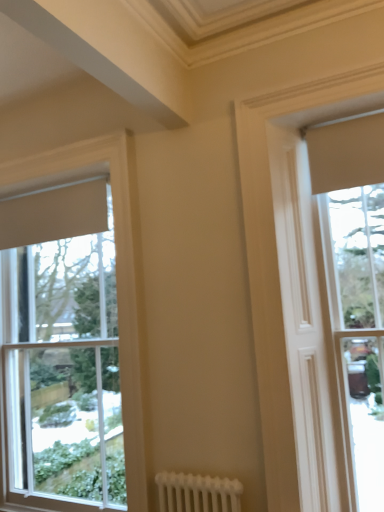
Question: Considering the relative positions of white wood window at left, which ranks as the 1th window in left-to-right order, and matte beige window at upper right, which is the 2th window from right to left, in the image provided, is white wood window at left, which ranks as the 1th window in left-to-right order, to the left of matte beige window at upper right, which is the 2th window from right to left, from the viewer's perspective?

Choices:
 (A) yes
 (B) no

Answer: (A)

Question: Is white wood window at left, which ranks as the 1th window in left-to-right order, bigger than matte beige window at upper right, the second window when ordered from left to right?

Choices:
 (A) no
 (B) yes

Answer: (B)

Question: Is white wood window at left, marked as the 3th window in a right-to-left arrangement, positioned with its back to matte beige window at upper right, the second window when ordered from left to right?

Choices:
 (A) no
 (B) yes

Answer: (A)

Question: From the image's perspective, is white wood window at left, which ranks as the 1th window in left-to-right order, beneath matte beige window at upper right, the second window when ordered from left to right?

Choices:
 (A) yes
 (B) no

Answer: (A)

Question: Is white wood window at left, which ranks as the 1th window in left-to-right order, outside of matte beige window at upper right, the second window when ordered from left to right?

Choices:
 (A) no
 (B) yes

Answer: (B)

Question: Does white wood window at left, which ranks as the 1th window in left-to-right order, have a smaller size compared to matte beige window at upper right, the second window when ordered from left to right?

Choices:
 (A) no
 (B) yes

Answer: (A)

Question: Would you say matte beige curtain at right, the 1th window viewed from the right, contains matte beige window at upper right, which is the 2th window from right to left?

Choices:
 (A) no
 (B) yes

Answer: (A)

Question: From the image's perspective, is matte beige curtain at right, the 1th window viewed from the right, beneath matte beige window at upper right, which is the 2th window from right to left?

Choices:
 (A) yes
 (B) no

Answer: (A)

Question: Is matte beige curtain at right, placed as the 3th window when sorted from left to right, to the left of matte beige window at upper right, which is the 2th window from right to left, from the viewer's perspective?

Choices:
 (A) no
 (B) yes

Answer: (A)

Question: Is the position of matte beige curtain at right, the 1th window viewed from the right, more distant than that of matte beige window at upper right, the second window when ordered from left to right?

Choices:
 (A) no
 (B) yes

Answer: (B)

Question: Is matte beige curtain at right, the 1th window viewed from the right, taller than matte beige window at upper right, the second window when ordered from left to right?

Choices:
 (A) yes
 (B) no

Answer: (B)

Question: From the image's perspective, is matte beige curtain at right, placed as the 3th window when sorted from left to right, over matte beige window at upper right, the second window when ordered from left to right?

Choices:
 (A) yes
 (B) no

Answer: (B)

Question: Are white wood window at left, marked as the 3th window in a right-to-left arrangement, and matte beige curtain at right, placed as the 3th window when sorted from left to right, far apart?

Choices:
 (A) yes
 (B) no

Answer: (A)